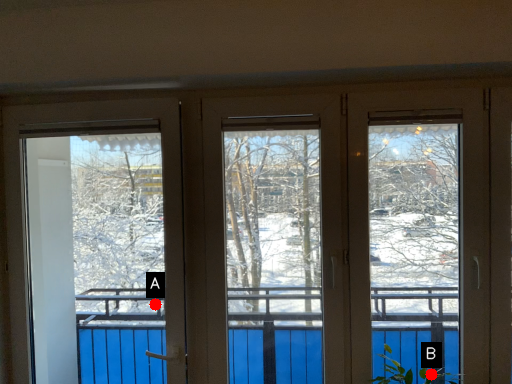
Question: Two points are circled on the image, labeled by A and B beside each circle. Which point is further to the camera?

Choices:
 (A) A is further
 (B) B is further

Answer: (A)